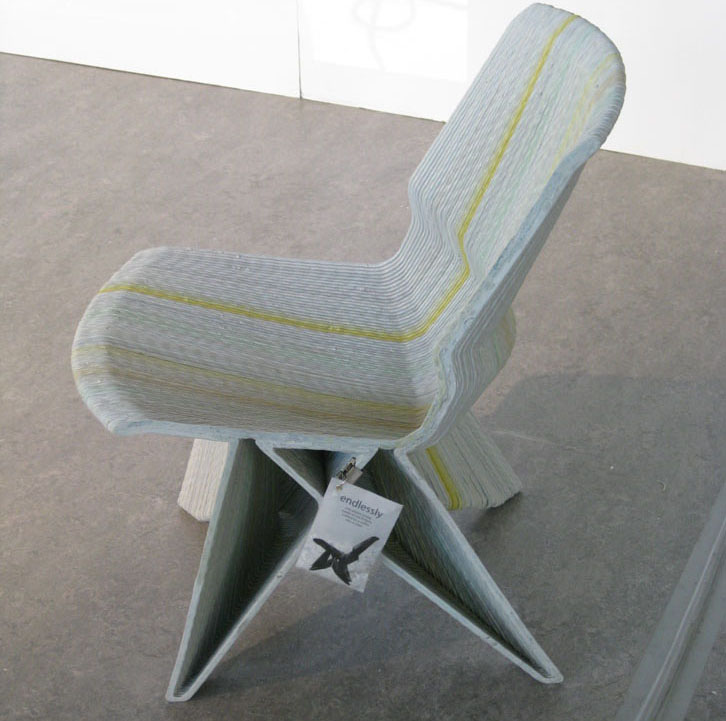
The width and height of the screenshot is (726, 721). What are the coordinates of `top of back of chair` in the screenshot? It's located at (591, 27).